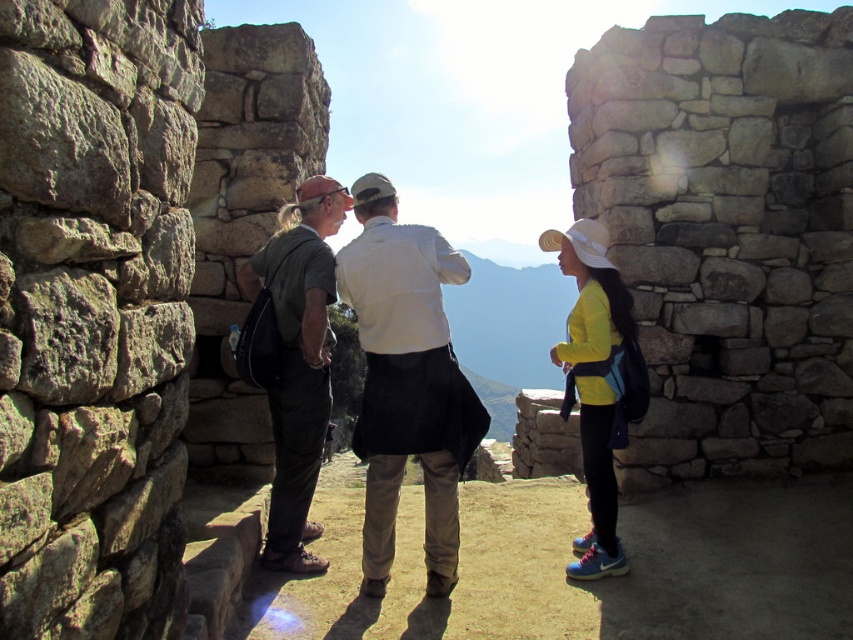
Does matte black jacket at center come in front of white matte shirt at center?

No, matte black jacket at center is further to the viewer.

Who is positioned more to the left, matte black jacket at center or white matte shirt at center?

Positioned to the left is white matte shirt at center.

Does point (442, 573) come farther from viewer compared to point (381, 188)?

No, (442, 573) is closer to viewer.

The height and width of the screenshot is (640, 853). I want to click on matte black jacket at center, so click(x=405, y=380).

Is matte black jacket at center further to the viewer compared to dark gray fabric shirt at center?

No, matte black jacket at center is closer to the viewer.

Does matte black jacket at center have a lesser height compared to dark gray fabric shirt at center?

Indeed, matte black jacket at center has a lesser height compared to dark gray fabric shirt at center.

Where is `matte black jacket at center`? This screenshot has height=640, width=853. matte black jacket at center is located at coordinates (405, 380).

Is point (450, 573) positioned in front of point (583, 221)?

Yes.

Between matte black jacket at center and yellow matte jacket at center, which one appears on the left side from the viewer's perspective?

matte black jacket at center

Is point (599, 300) farther from camera compared to point (595, 304)?

Yes, point (599, 300) is farther from viewer.

At what (x,y) coordinates should I click in order to perform the action: click on matte black jacket at center. Please return your answer as a coordinate pair (x, y). Looking at the image, I should click on (405, 380).